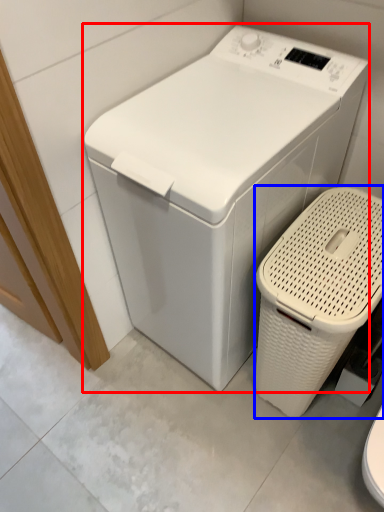
Question: Which object is closer to the camera taking this photo, washing machine (highlighted by a red box) or garbage (highlighted by a blue box)?

Choices:
 (A) washing machine
 (B) garbage

Answer: (A)